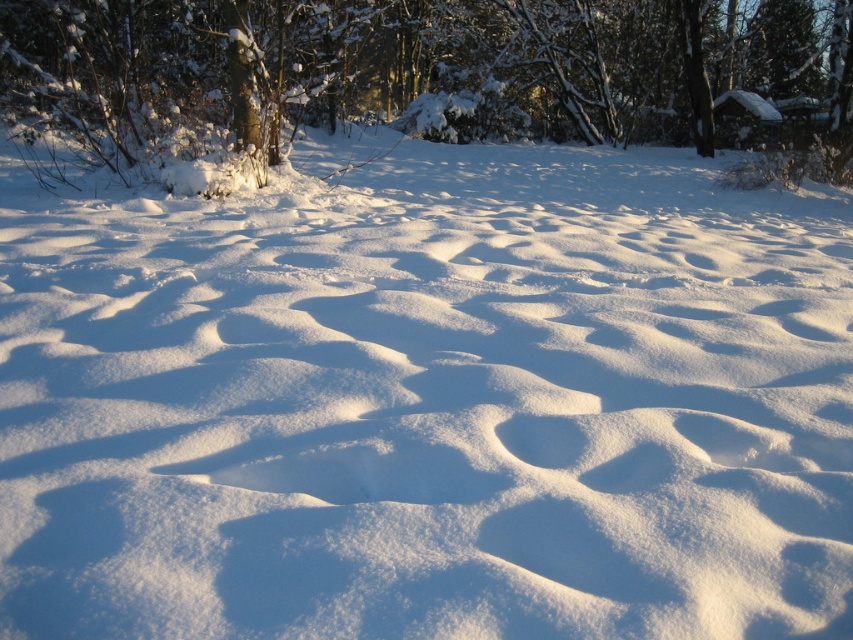
Question: Does snowy bark tree at upper center lie in front of white fluffy footprint at center?

Choices:
 (A) yes
 (B) no

Answer: (B)

Question: Which point is farther to the camera?

Choices:
 (A) white fluffy footprint at center
 (B) snowy bark tree at upper center

Answer: (B)

Question: In this image, where is snowy bark tree at upper center located relative to white fluffy footprint at center?

Choices:
 (A) right
 (B) left

Answer: (A)

Question: Can you confirm if snowy bark tree at upper center is wider than white fluffy footprint at center?

Choices:
 (A) yes
 (B) no

Answer: (A)

Question: Which point is farther to the camera?

Choices:
 (A) white fluffy footprint at center
 (B) snowy bark tree at upper center

Answer: (B)